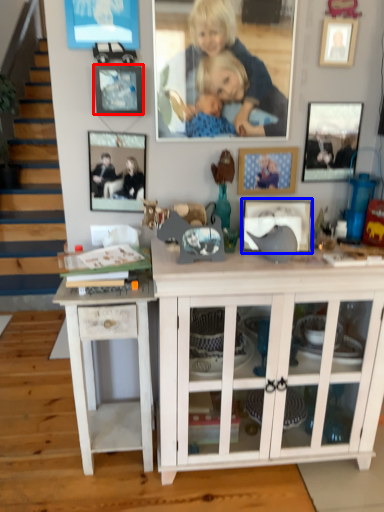
Question: Among these objects, which one is farthest to the camera, picture frame (highlighted by a red box) or picture frame (highlighted by a blue box)?

Choices:
 (A) picture frame
 (B) picture frame

Answer: (B)